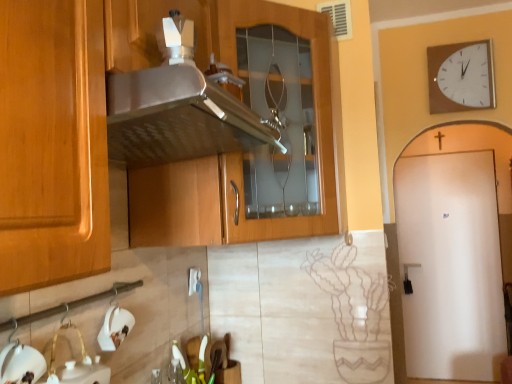
What is the approximate width of white glossy sink at lower left?

white glossy sink at lower left is 5.31 centimeters in width.

At what (x,y) coordinates should I click in order to perform the action: click on white matte door at right. Please return your answer as a coordinate pair (x, y). Image resolution: width=512 pixels, height=384 pixels. Looking at the image, I should click on (453, 251).

Describe the element at coordinates (76, 364) in the screenshot. I see `white matte sink at lower left` at that location.

What do you see at coordinates (153, 132) in the screenshot? I see `satin wood cabinet at center` at bounding box center [153, 132].

You are a GUI agent. You are given a task and a screenshot of the screen. Output one action in this format:
    pyautogui.click(x=<x>, y=<y>)
    Task: Click on the white glossy sink at lower left
    
    Given the screenshot: What is the action you would take?
    pyautogui.click(x=21, y=364)

From the image's perspective, which is above, white glossy sink at lower left or satin wood cabinet at center?

satin wood cabinet at center is shown above in the image.

Measure the distance between white glossy sink at lower left and satin wood cabinet at center.

A distance of 25.96 inches exists between white glossy sink at lower left and satin wood cabinet at center.

Which is nearer, (41, 362) or (36, 62)?

The point (36, 62) is in front.

Who is taller, white glossy sink at lower left or satin wood cabinet at center?

satin wood cabinet at center is taller.

Is satin wood cabinet at center positioned far away from white glossy sink at lower left?

No.

Is satin wood cabinet at center wider than white glossy sink at lower left?

Indeed, satin wood cabinet at center has a greater width compared to white glossy sink at lower left.

Considering the positions of points (217, 19) and (9, 379), is point (217, 19) farther from camera compared to point (9, 379)?

That is True.

From a real-world perspective, who is located higher, white wooden wall clock at upper right or satin wood cabinet at center?

→ white wooden wall clock at upper right.

I want to click on cabinetry below the white wooden wall clock at upper right (from a real-world perspective), so click(153, 132).

Would you say white wooden wall clock at upper right is outside satin wood cabinet at center?

Indeed, white wooden wall clock at upper right is completely outside satin wood cabinet at center.

Would you consider white wooden wall clock at upper right to be distant from satin wood cabinet at center?

white wooden wall clock at upper right is far away from satin wood cabinet at center.

Are white matte door at right and white glossy sink at lower left beside each other?

No, white matte door at right is not in contact with white glossy sink at lower left.

Which object is wider, white matte door at right or white glossy sink at lower left?

Wider between the two is white matte door at right.

From a real-world perspective, is white matte door at right located higher than white glossy sink at lower left?

Incorrect, from a real-world perspective, white matte door at right is lower than white glossy sink at lower left.

From the image's perspective, which object appears higher, white matte door at right or white glossy sink at lower left?

From the image's view, white glossy sink at lower left is above.

Can white wooden wall clock at upper right be found inside white matte sink at lower left?

No.

From the picture: Does white matte sink at lower left have a lesser width compared to white wooden wall clock at upper right?

No.

Is white matte sink at lower left touching white wooden wall clock at upper right?

No, white matte sink at lower left is not making contact with white wooden wall clock at upper right.

You are a GUI agent. You are given a task and a screenshot of the screen. Output one action in this format:
    pyautogui.click(x=<x>, y=<y>)
    Task: Click on the wall clock on the right of white matte sink at lower left
    
    Given the screenshot: What is the action you would take?
    pyautogui.click(x=461, y=77)

Consider the image. Can you see white glossy sink at lower left touching white matte sink at lower left?

No, white glossy sink at lower left is not in contact with white matte sink at lower left.

From their relative heights in the image, would you say white glossy sink at lower left is taller or shorter than white matte sink at lower left?

Clearly, white glossy sink at lower left is shorter compared to white matte sink at lower left.

Where is `appliance on the left of the white matte sink at lower left`? appliance on the left of the white matte sink at lower left is located at coordinates (21, 364).

Is white glossy sink at lower left turned away from white matte sink at lower left?

That's not correct — white glossy sink at lower left is not looking away from white matte sink at lower left.

Can you confirm if white matte sink at lower left is smaller than satin wood cabinet at center?

Correct, white matte sink at lower left occupies less space than satin wood cabinet at center.

In the image, there is a white matte sink at lower left. At what (x,y) coordinates should I click in order to perform the action: click on cabinetry above it (from the image's perspective). Please return your answer as a coordinate pair (x, y). This screenshot has height=384, width=512. Looking at the image, I should click on (153, 132).

From a real-world perspective, is white matte sink at lower left located beneath satin wood cabinet at center?

Correct, in the physical world, white matte sink at lower left is lower than satin wood cabinet at center.

Does white matte sink at lower left have a greater width compared to satin wood cabinet at center?

Incorrect, the width of white matte sink at lower left does not surpass that of satin wood cabinet at center.

Where is `cabinetry behind the white glossy sink at lower left`? cabinetry behind the white glossy sink at lower left is located at coordinates (153, 132).

Locate an element on the screen. Image resolution: width=512 pixels, height=384 pixels. cabinetry above the white glossy sink at lower left (from a real-world perspective) is located at coordinates (153, 132).

Based on their spatial positions, is white wooden wall clock at upper right or white matte sink at lower left closer to white glossy sink at lower left?

white matte sink at lower left is closer to white glossy sink at lower left.

Based on their spatial positions, is white wooden wall clock at upper right or white matte door at right further from satin wood cabinet at center?

Among the two, white matte door at right is located further to satin wood cabinet at center.

Which object lies further to the anchor point white matte door at right, white glossy sink at lower left or satin wood cabinet at center?

The object further to white matte door at right is white glossy sink at lower left.

Looking at the image, which one is located closer to white glossy sink at lower left, white matte sink at lower left or satin wood cabinet at center?

Based on the image, white matte sink at lower left appears to be nearer to white glossy sink at lower left.

Considering their positions, is white matte door at right positioned closer to white matte sink at lower left than white wooden wall clock at upper right?

Based on the image, white wooden wall clock at upper right appears to be nearer to white matte sink at lower left.

Based on their spatial positions, is satin wood cabinet at center or white wooden wall clock at upper right further from white glossy sink at lower left?

white wooden wall clock at upper right lies further to white glossy sink at lower left than the other object.

From the image, which object appears to be nearer to satin wood cabinet at center, white wooden wall clock at upper right or white matte sink at lower left?

white matte sink at lower left lies closer to satin wood cabinet at center than the other object.

Which object lies nearer to the anchor point white matte sink at lower left, white glossy sink at lower left or white wooden wall clock at upper right?

Based on the image, white glossy sink at lower left appears to be nearer to white matte sink at lower left.

Identify the location of cabinetry located between white glossy sink at lower left and white matte door at right in the depth direction. (153, 132).

This screenshot has width=512, height=384. In order to click on appliance between satin wood cabinet at center and white matte sink at lower left in the vertical direction in this screenshot , I will do point(21,364).

Find the location of a particular element. cabinetry between white matte sink at lower left and white wooden wall clock at upper right in the horizontal direction is located at coordinates (153, 132).

At what (x,y) coordinates should I click in order to perform the action: click on cabinetry between white matte sink at lower left and white matte door at right in the front-back direction. Please return your answer as a coordinate pair (x, y). The width and height of the screenshot is (512, 384). Looking at the image, I should click on (153, 132).